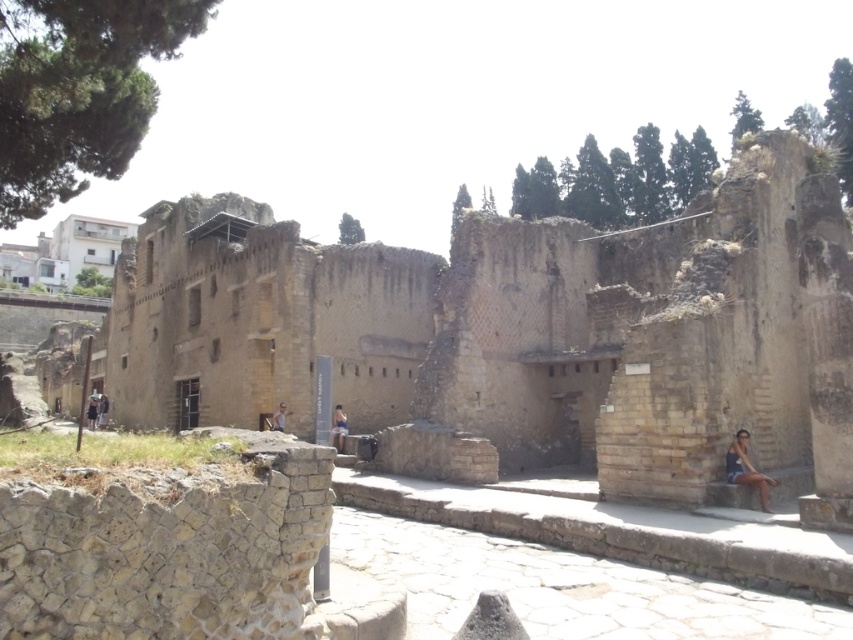
Is blue denim shorts at center to the right of dark brown leather jacket at center from the viewer's perspective?

Correct, you'll find blue denim shorts at center to the right of dark brown leather jacket at center.

Which is below, blue denim shorts at center or dark brown leather jacket at center?

dark brown leather jacket at center is below.

The height and width of the screenshot is (640, 853). In order to click on blue denim shorts at center in this screenshot , I will do `click(338, 428)`.

Find the location of `blue denim shorts at center`. blue denim shorts at center is located at coordinates (338, 428).

Which of these two, matte blue tank top at lower right or dark brown leather jacket at center, stands shorter?

matte blue tank top at lower right is shorter.

At what (x,y) coordinates should I click in order to perform the action: click on matte blue tank top at lower right. Please return your answer as a coordinate pair (x, y). This screenshot has height=640, width=853. Looking at the image, I should click on (746, 468).

The image size is (853, 640). What are the coordinates of `matte blue tank top at lower right` in the screenshot? It's located at (746, 468).

Can you confirm if earthy stone ruins at center is taller than dark brown leather jacket at center?

Yes.

This screenshot has height=640, width=853. Describe the element at coordinates (526, 339) in the screenshot. I see `earthy stone ruins at center` at that location.

Is point (625, 282) less distant than point (105, 422)?

Yes, it is in front of point (105, 422).

Locate an element on the screen. earthy stone ruins at center is located at coordinates (526, 339).